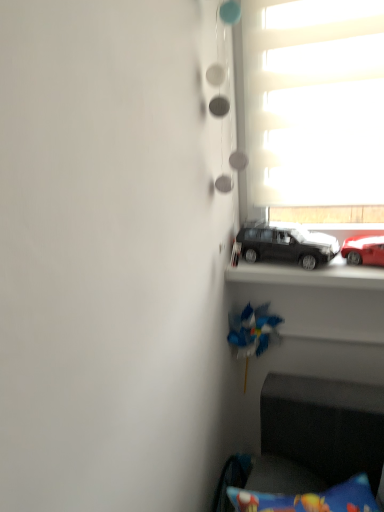
In order to face matte black car at center, the 1th car in the left-to-right sequence, should I rotate leftwards or rightwards?

Rotate right and turn 12.255 degrees.

I want to click on velvet dark blue armchair at lower right, so click(x=310, y=449).

Would you say white matte window at upper right contains blue plastic toy at center?

Actually, blue plastic toy at center is outside white matte window at upper right.

Is white matte window at upper right beside blue plastic toy at center?

No.

From a real-world perspective, is white matte window at upper right located beneath blue plastic toy at center?

No, from a real-world perspective, white matte window at upper right is not beneath blue plastic toy at center.

There is a matte black car at center, the 1th car in the left-to-right sequence. At what (x,y) coordinates should I click in order to perform the action: click on window above it (from a real-world perspective). Please return your answer as a coordinate pair (x, y). This screenshot has width=384, height=512. Looking at the image, I should click on (314, 102).

From a real-world perspective, is white matte window at upper right physically above matte black car at center, the second car from the right?

Yes.

How distant is white matte window at upper right from matte black car at center, the 1th car in the left-to-right sequence?

white matte window at upper right is 12.98 inches away from matte black car at center, the 1th car in the left-to-right sequence.

Between white matte window at upper right and matte black car at center, the second car from the right, which one has smaller size?

With smaller size is matte black car at center, the second car from the right.

This screenshot has height=512, width=384. Identify the location of armchair located on the left of matte black car at center, the second car from the right. (310, 449).

Would you consider velvet dark blue armchair at lower right to be distant from matte black car at center, the 1th car in the left-to-right sequence?

No, there isn't a large distance between velvet dark blue armchair at lower right and matte black car at center, the 1th car in the left-to-right sequence.

Which point is more forward, (x=239, y=511) or (x=291, y=246)?

The point (x=239, y=511) is in front.

How many degrees apart are the facing directions of velvet dark blue armchair at lower right and blue plastic toy at center?

28.6 degrees separate the facing orientations of velvet dark blue armchair at lower right and blue plastic toy at center.

Between velvet dark blue armchair at lower right and blue plastic toy at center, which one has larger width?

velvet dark blue armchair at lower right.

In the image, is velvet dark blue armchair at lower right on the left side or the right side of blue plastic toy at center?

From the image, it's evident that velvet dark blue armchair at lower right is to the right of blue plastic toy at center.

Is point (235, 318) behind point (357, 402)?

Yes, it is.

Who is shorter, blue plastic toy at center or velvet dark blue armchair at lower right?

velvet dark blue armchair at lower right.

From the image's perspective, which one is positioned higher, blue plastic toy at center or velvet dark blue armchair at lower right?

blue plastic toy at center, from the image's perspective.

In order to click on armchair located underneath the blue plastic toy at center (from a real-world perspective) in this screenshot , I will do `click(310, 449)`.

Is point (311, 237) closer or farther from the camera than point (252, 9)?

Clearly, point (311, 237) is more distant from the camera than point (252, 9).

Is matte black car at center, the second car from the right, further to the viewer compared to white matte window at upper right?

Yes, it is behind white matte window at upper right.

Considering the relative sizes of matte black car at center, the 1th car in the left-to-right sequence, and white matte window at upper right in the image provided, is matte black car at center, the 1th car in the left-to-right sequence, shorter than white matte window at upper right?

Correct, matte black car at center, the 1th car in the left-to-right sequence, is not as tall as white matte window at upper right.

From a real-world perspective, is matte black car at center, the 1th car in the left-to-right sequence, located higher than white matte window at upper right?

No.

In the image, is velvet dark blue armchair at lower right positioned in front of or behind shiny red car at right, the 1th car positioned from the right?

Visually, velvet dark blue armchair at lower right is located in front of shiny red car at right, the 1th car positioned from the right.

Is the surface of velvet dark blue armchair at lower right in direct contact with shiny red car at right, which is the second car in left-to-right order?

No, velvet dark blue armchair at lower right is not making contact with shiny red car at right, which is the second car in left-to-right order.

In the image, is velvet dark blue armchair at lower right on the left side or the right side of shiny red car at right, the 1th car positioned from the right?

velvet dark blue armchair at lower right is to the left of shiny red car at right, the 1th car positioned from the right.

Could you tell me if velvet dark blue armchair at lower right is facing shiny red car at right, which is the second car in left-to-right order?

No, velvet dark blue armchair at lower right is not turned towards shiny red car at right, which is the second car in left-to-right order.

Find the location of `toy below the white matte window at upper right (from a real-world perspective)`. toy below the white matte window at upper right (from a real-world perspective) is located at coordinates (253, 332).

Identify the location of window in front of the matte black car at center, the second car from the right. The height and width of the screenshot is (512, 384). (314, 102).

When comparing their distances from matte black car at center, the second car from the right, does velvet dark blue armchair at lower right or shiny red car at right, the 1th car positioned from the right, seem closer?

shiny red car at right, the 1th car positioned from the right, is closer to matte black car at center, the second car from the right.

Estimate the real-world distances between objects in this image. Which object is further from blue plastic toy at center, shiny red car at right, which is the second car in left-to-right order, or matte black car at center, the second car from the right?

Among the two, shiny red car at right, which is the second car in left-to-right order, is located further to blue plastic toy at center.

From the image, which object appears to be nearer to white matte window at upper right, shiny red car at right, which is the second car in left-to-right order, or matte black car at center, the 1th car in the left-to-right sequence?

The object closer to white matte window at upper right is matte black car at center, the 1th car in the left-to-right sequence.

Estimate the real-world distances between objects in this image. Which object is further from velvet dark blue armchair at lower right, shiny red car at right, the 1th car positioned from the right, or blue plastic toy at center?

shiny red car at right, the 1th car positioned from the right, lies further to velvet dark blue armchair at lower right than the other object.

From the image, which object appears to be farther from white matte window at upper right, blue plastic toy at center or velvet dark blue armchair at lower right?

velvet dark blue armchair at lower right lies further to white matte window at upper right than the other object.

Estimate the real-world distances between objects in this image. Which object is further from white matte window at upper right, shiny red car at right, the 1th car positioned from the right, or velvet dark blue armchair at lower right?

velvet dark blue armchair at lower right.

From the image, which object appears to be farther from matte black car at center, the second car from the right, shiny red car at right, the 1th car positioned from the right, or white matte window at upper right?

Based on the image, white matte window at upper right appears to be further to matte black car at center, the second car from the right.

Looking at this image, when comparing their distances from velvet dark blue armchair at lower right, does matte black car at center, the second car from the right, or blue plastic toy at center seem closer?

blue plastic toy at center.

You are a GUI agent. You are given a task and a screenshot of the screen. Output one action in this format:
    pyautogui.click(x=<x>, y=<y>)
    Task: Click on the toy that lies between matte black car at center, the 1th car in the left-to-right sequence, and velvet dark blue armchair at lower right from top to bottom
    
    Given the screenshot: What is the action you would take?
    pyautogui.click(x=253, y=332)

This screenshot has width=384, height=512. Find the location of `car between white matte window at upper right and shiny red car at right, which is the second car in left-to-right order, vertically`. car between white matte window at upper right and shiny red car at right, which is the second car in left-to-right order, vertically is located at coordinates (286, 244).

Where is `car between matte black car at center, the 1th car in the left-to-right sequence, and velvet dark blue armchair at lower right from top to bottom`? This screenshot has width=384, height=512. car between matte black car at center, the 1th car in the left-to-right sequence, and velvet dark blue armchair at lower right from top to bottom is located at coordinates (364, 249).

Identify the location of toy between shiny red car at right, which is the second car in left-to-right order, and velvet dark blue armchair at lower right, in the vertical direction. (253, 332).